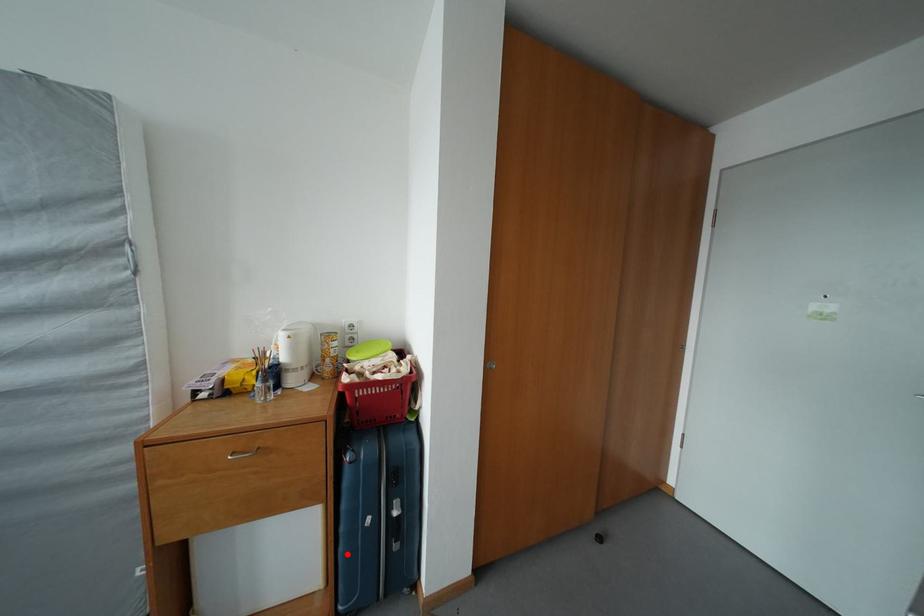
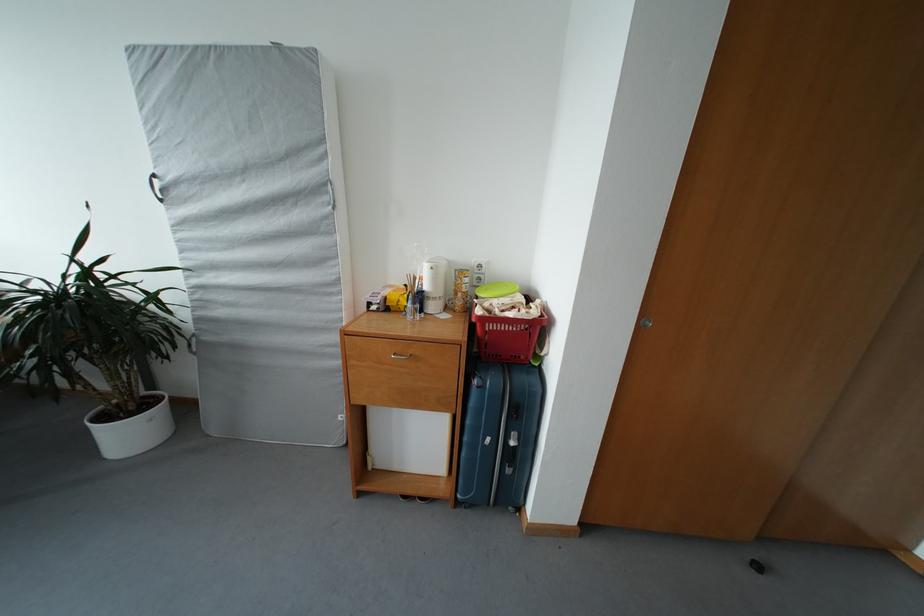
Find the pixel in the second image that matches the highlighted location in the first image.

(469, 459)